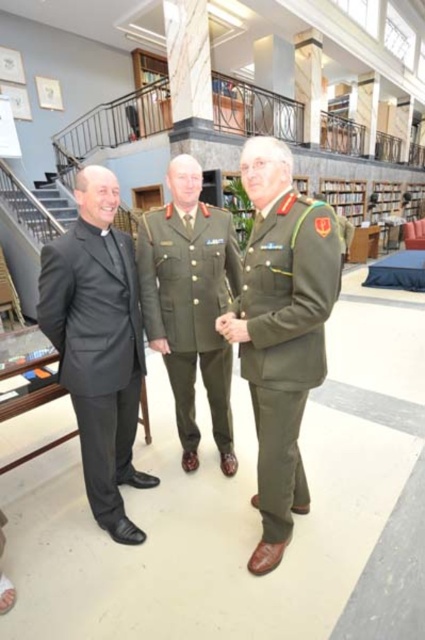
Question: Which of these objects is positioned closest to the matte olive-green uniform at center?

Choices:
 (A) black matte suit at left
 (B) olive green fabric military uniform at center

Answer: (B)

Question: Which object is farther from the camera taking this photo?

Choices:
 (A) olive green fabric military uniform at center
 (B) black matte suit at left
 (C) matte olive-green uniform at center

Answer: (A)

Question: Among these objects, which one is nearest to the camera?

Choices:
 (A) matte olive-green uniform at center
 (B) black matte suit at left
 (C) olive green fabric military uniform at center

Answer: (A)

Question: Does matte olive-green uniform at center have a smaller size compared to olive green fabric military uniform at center?

Choices:
 (A) yes
 (B) no

Answer: (B)

Question: Is the position of black matte suit at left more distant than that of olive green fabric military uniform at center?

Choices:
 (A) no
 (B) yes

Answer: (A)

Question: Is black matte suit at left closer to the viewer compared to olive green fabric military uniform at center?

Choices:
 (A) no
 (B) yes

Answer: (B)